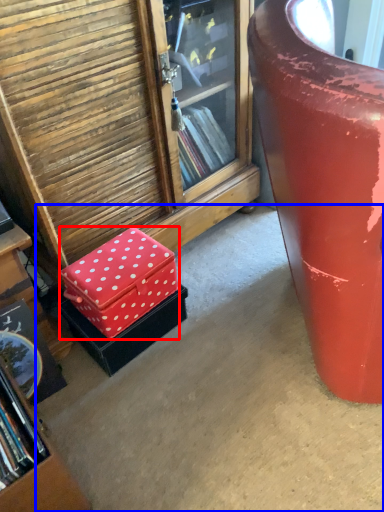
Question: Which of the following is the closest to the observer, box (highlighted by a red box) or concrete (highlighted by a blue box)?

Choices:
 (A) box
 (B) concrete

Answer: (B)